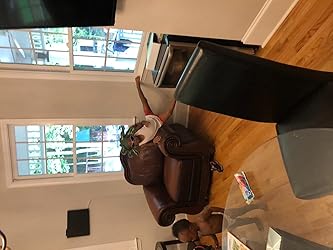
Locate an element on the screen. black child leaning on brown leather chair is located at coordinates (148, 132).